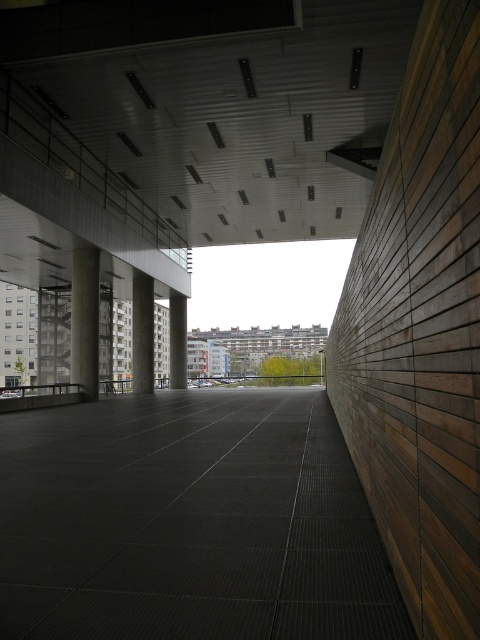
Does dark gray concrete corridor at center have a greater height compared to concrete column at center?

Yes, dark gray concrete corridor at center is taller than concrete column at center.

Which of these two, dark gray concrete corridor at center or concrete column at center, stands taller?

Standing taller between the two is dark gray concrete corridor at center.

The image size is (480, 640). Describe the element at coordinates (189, 522) in the screenshot. I see `dark gray concrete corridor at center` at that location.

Locate an element on the screen. dark gray concrete corridor at center is located at coordinates (189, 522).

Can you confirm if wooden plank at right is wider than concrete pillar at center?

Incorrect, wooden plank at right's width does not surpass concrete pillar at center's.

Is wooden plank at right shorter than concrete pillar at center?

Yes, wooden plank at right is shorter than concrete pillar at center.

The image size is (480, 640). In order to click on wooden plank at right in this screenshot , I will do `click(420, 330)`.

Can you confirm if concrete pillar at center is wider than matte gray concrete pillar at center?

Yes.

Is concrete pillar at center to the left of matte gray concrete pillar at center from the viewer's perspective?

Indeed, concrete pillar at center is positioned on the left side of matte gray concrete pillar at center.

Find the location of a particular element. concrete pillar at center is located at coordinates (142, 332).